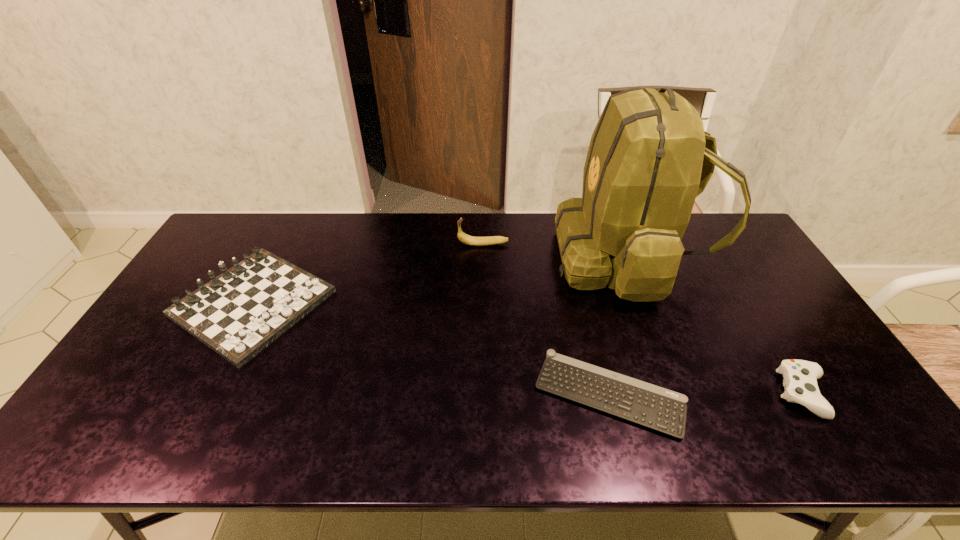
The height and width of the screenshot is (540, 960). Identify the location of vacant region located 0.350m at the stem of the banana. (357, 244).

At what (x,y) coordinates should I click in order to perform the action: click on vacant region located 0.110m at the stem of the banana. Please return your answer as a coordinate pair (x, y). The height and width of the screenshot is (540, 960). Looking at the image, I should click on (426, 244).

This screenshot has height=540, width=960. I want to click on free space located at the stem of the banana, so click(x=415, y=244).

Where is `free space located 0.180m on the back of the chessboard`? This screenshot has height=540, width=960. free space located 0.180m on the back of the chessboard is located at coordinates (296, 221).

Locate an element on the screen. This screenshot has width=960, height=540. vacant region located 0.190m on the back of the control is located at coordinates (755, 314).

Find the location of a particular element. This screenshot has width=960, height=540. vacant space situated on the right of the shortest object is located at coordinates (796, 394).

The width and height of the screenshot is (960, 540). I want to click on backpack located in the far edge section of the desktop, so click(649, 157).

Where is `banana at the far edge`? banana at the far edge is located at coordinates (464, 238).

Identify the location of chessboard located in the far edge section of the desktop. (239, 313).

In order to click on control that is at the near edge in this screenshot , I will do `click(800, 377)`.